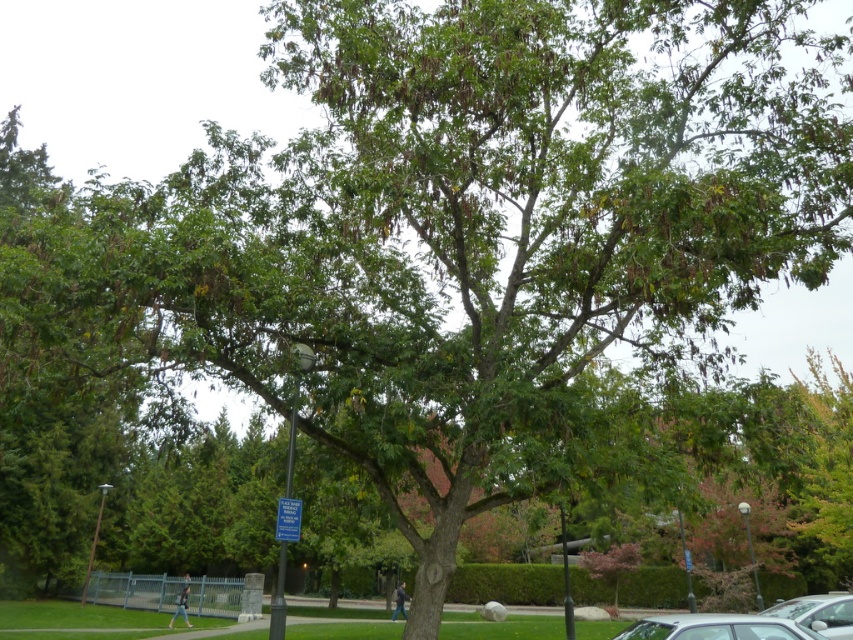
You are a pedestrian standing at the edge of the park near the hedge. You need to cross the paved pathway where the two silver metallic car at lower center and silver metallic car at lower right are parked. If the space between them is exactly 19.42 feet, can a standard delivery truck that is 18 feet long safely pass through the gap between the two cars without needing to move either car?

The distance between the silver metallic car at lower center and the silver metallic car at lower right is 19.42 feet. Since the standard delivery truck is 18 feet long, it can safely pass through the gap as the space available is slightly larger than the truck length.

You are a photographer setting up a tripod in the park. You need to position it so that both the silver metallic car at lower center and the silver metallic car at lower right are visible in your shot. Given their sizes, which car will appear larger in the final photograph?

The silver metallic car at lower right will appear larger in the final photograph because it is bigger than the silver metallic car at lower center.